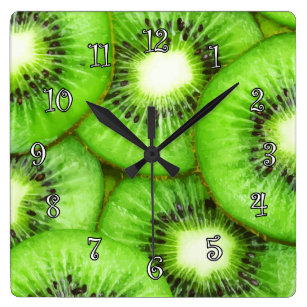
This screenshot has width=307, height=307. Identify the location of kiwi decoration. (107, 267), (109, 192), (243, 63), (72, 52), (139, 212).